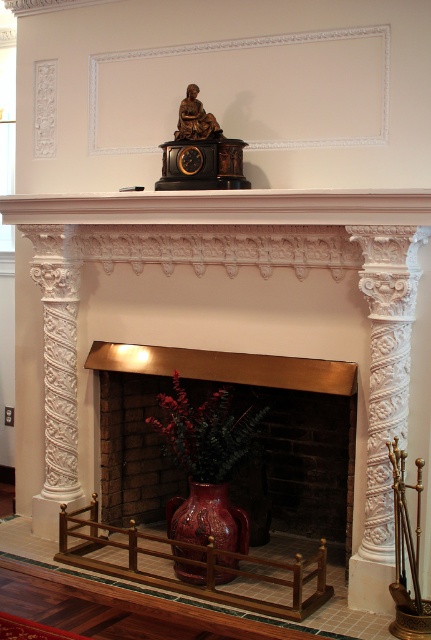
Does white carved stone column at right appear under white carved stone column at center?

Indeed, white carved stone column at right is positioned under white carved stone column at center.

Is point (378, 483) positioned in front of point (22, 225)?

Yes.

The image size is (431, 640). Describe the element at coordinates (384, 394) in the screenshot. I see `white carved stone column at right` at that location.

This screenshot has height=640, width=431. Find the location of `white carved stone column at right`. white carved stone column at right is located at coordinates (384, 394).

Which is below, white carved stone column at center or matte red vase at center?

matte red vase at center is lower down.

Locate an element on the screen. white carved stone column at center is located at coordinates (56, 369).

How much distance is there between white carved stone column at right and matte brown clock at upper center?

The distance of white carved stone column at right from matte brown clock at upper center is 1.46 meters.

Is white carved stone column at right positioned behind matte brown clock at upper center?

No, it is not.

You are a GUI agent. You are given a task and a screenshot of the screen. Output one action in this format:
    pyautogui.click(x=<x>, y=<y>)
    Task: Click on the white carved stone column at right
    
    Given the screenshot: What is the action you would take?
    pyautogui.click(x=384, y=394)